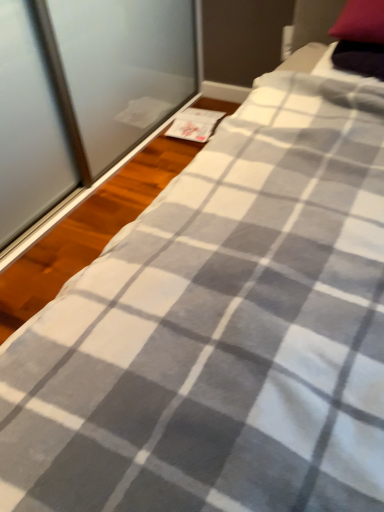
Image resolution: width=384 pixels, height=512 pixels. What do you see at coordinates (360, 22) in the screenshot? I see `red velvet pillow at upper right` at bounding box center [360, 22].

I want to click on red velvet pillow at upper right, so click(x=360, y=22).

Measure the distance between red velvet pillow at upper right and camera.

The distance of red velvet pillow at upper right from camera is 1.27 meters.

The height and width of the screenshot is (512, 384). Identify the location of red velvet pillow at upper right. (360, 22).